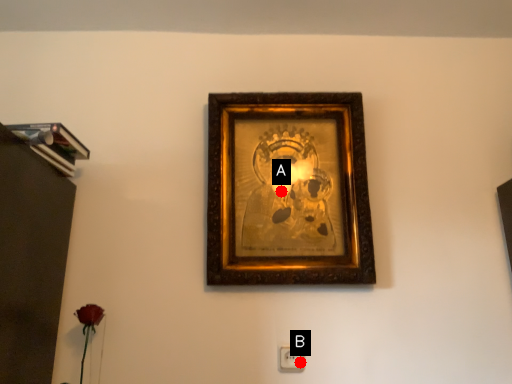
Question: Two points are circled on the image, labeled by A and B beside each circle. Which point is closer to the camera taking this photo?

Choices:
 (A) A is closer
 (B) B is closer

Answer: (B)